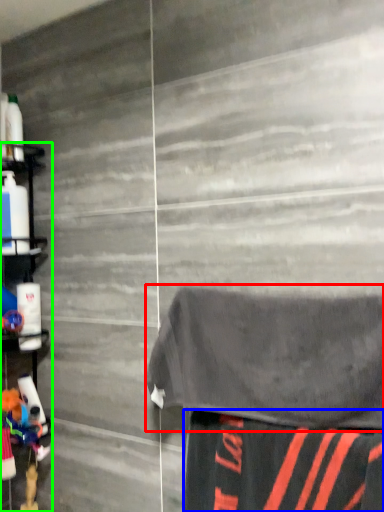
Question: Which object is the closest to the bath towel (highlighted by a red box)? Choose among these: fabric (highlighted by a blue box) or shelf (highlighted by a green box).

Choices:
 (A) fabric
 (B) shelf

Answer: (A)